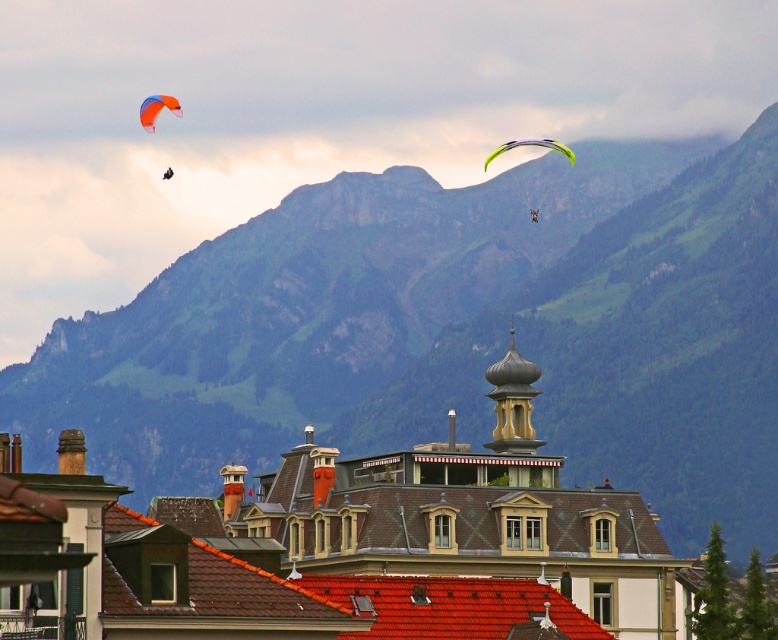
You are a drone operator trying to capture the green grassy mountain at upper center. The drone has a GPS coordinate system where the bottom left corner is the origin point. The mountain is at point 0.519, 0.587. If the drone is currently at point 0.4, 0.6, should you adjust the drone to the left or right to center the mountain in your shot?

The green grassy mountain at upper center is located at point (456, 332). Since the drone is at 0.4 on the x coordinate, which is to the left of 0.519, you should move the drone to the right to center the mountain.

You are a hiker planning to take a photo of the green grassy mountain at upper center and the green translucent parachute at upper right. Based on their positions, which object should you focus on first to ensure both are in frame?

The green grassy mountain at upper center is below the green translucent parachute at upper right, so you should focus on the green translucent parachute at upper right first to ensure both are in frame.

You are standing on the green grassy mountain at upper center and want to look up at the orange fabric parasail at upper left. In which direction should you look?

You should look upward because the orange fabric parasail at upper left is above the green grassy mountain at upper center.